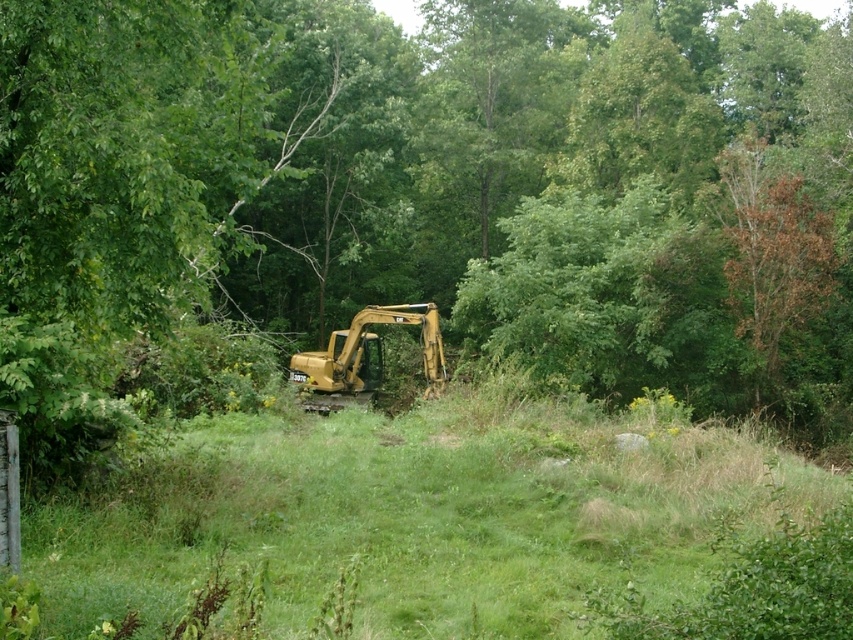
Question: Which object is farther from the camera taking this photo?

Choices:
 (A) yellow metallic excavator at center
 (B) green grass at center

Answer: (A)

Question: Which point appears farthest from the camera in this image?

Choices:
 (A) (437, 356)
 (B) (544, 592)

Answer: (A)

Question: Is green grass at center behind yellow metallic excavator at center?

Choices:
 (A) no
 (B) yes

Answer: (A)

Question: Is green grass at center further to the viewer compared to yellow metallic excavator at center?

Choices:
 (A) yes
 (B) no

Answer: (B)

Question: Which point is closer to the camera taking this photo?

Choices:
 (A) (430, 488)
 (B) (427, 310)

Answer: (A)

Question: Does green grass at center come behind yellow metallic excavator at center?

Choices:
 (A) no
 (B) yes

Answer: (A)